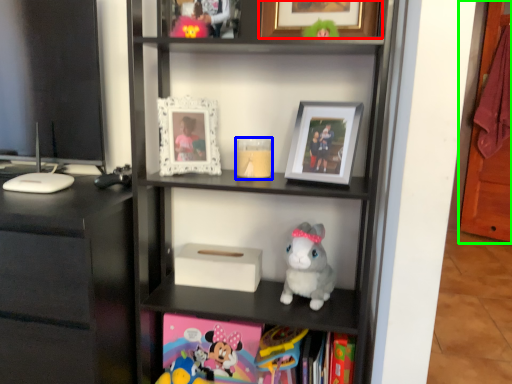
Question: Which object is the farthest from picture frame (highlighted by a red box)? Choose among these: candle holder (highlighted by a blue box) or glass door (highlighted by a green box).

Choices:
 (A) candle holder
 (B) glass door

Answer: (B)